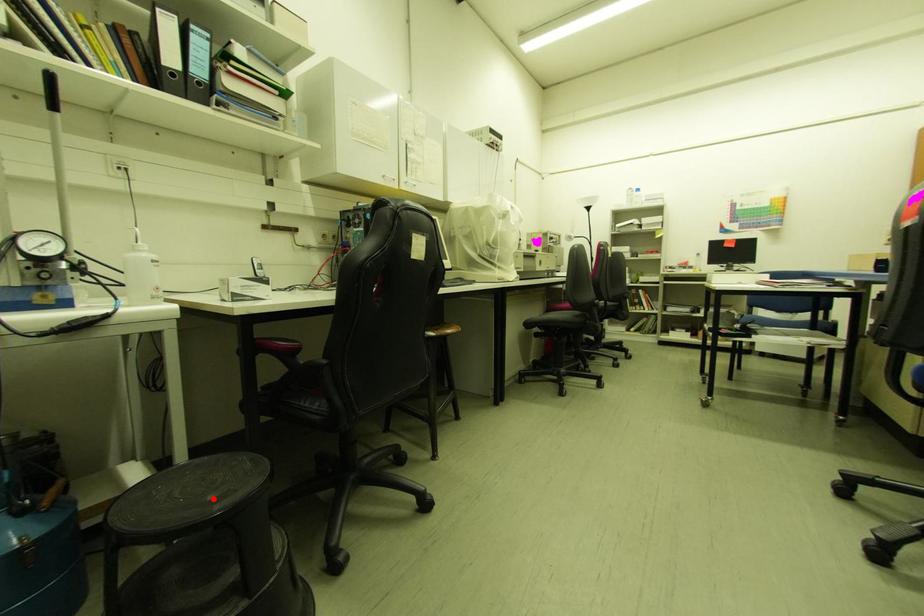
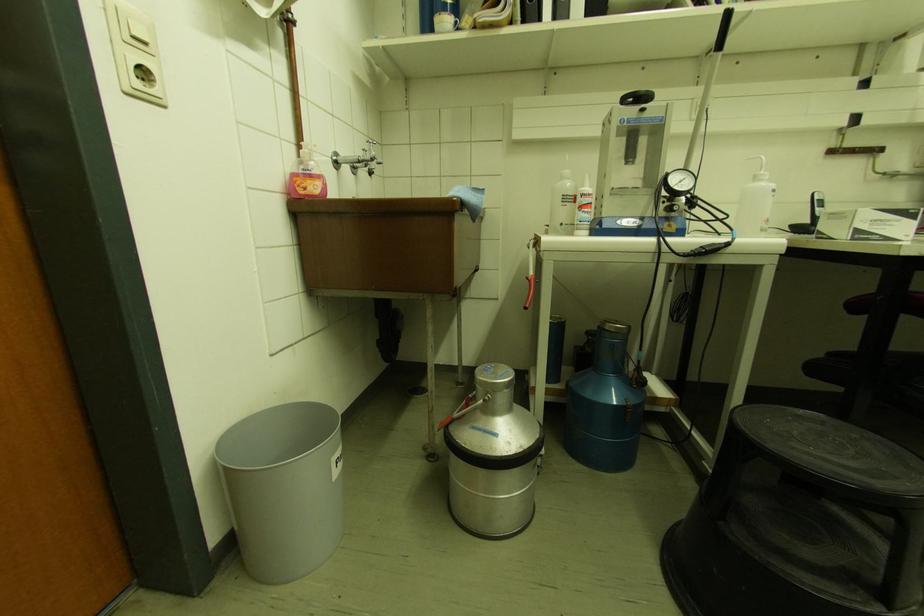
Find the pixel in the second image that matches the highlighted location in the first image.

(857, 466)